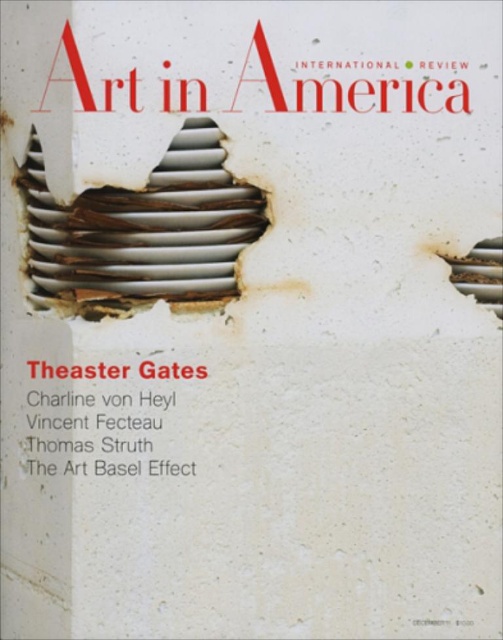
Who is positioned more to the right, rusty metal spiral at center or rusty metal hole at center right?

rusty metal hole at center right

Who is taller, rusty metal spiral at center or rusty metal hole at center right?

Standing taller between the two is rusty metal spiral at center.

Find the location of `rusty metal spiral at center`. rusty metal spiral at center is located at coordinates (142, 230).

Find the location of a particular element. This screenshot has width=503, height=640. rusty metal spiral at center is located at coordinates (142, 230).

Which is behind, point (144, 360) or point (447, 257)?

Point (447, 257)

What do you see at coordinates (76, 371) in the screenshot? I see `white matte text at center` at bounding box center [76, 371].

In order to click on white matte text at center in this screenshot , I will do `click(76, 371)`.

Can you confirm if rusty metal spiral at center is positioned above white matte text at center?

Yes, rusty metal spiral at center is above white matte text at center.

Can you confirm if rusty metal spiral at center is taller than white matte text at center?

Yes, rusty metal spiral at center is taller than white matte text at center.

I want to click on rusty metal spiral at center, so 142,230.

Find the location of a particular element. The height and width of the screenshot is (640, 503). rusty metal spiral at center is located at coordinates (142, 230).